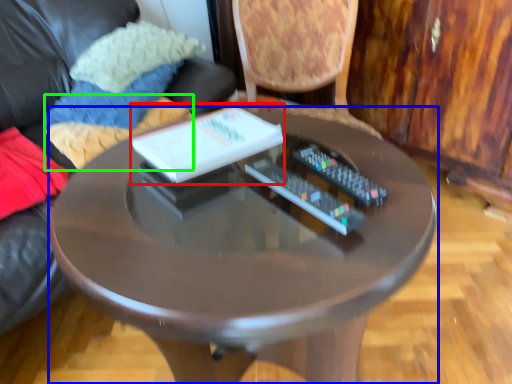
Question: Based on their relative distances, which object is nearer to book (highlighted by a red box)? Choose from table (highlighted by a blue box) and pillow (highlighted by a green box).

Choices:
 (A) table
 (B) pillow

Answer: (A)